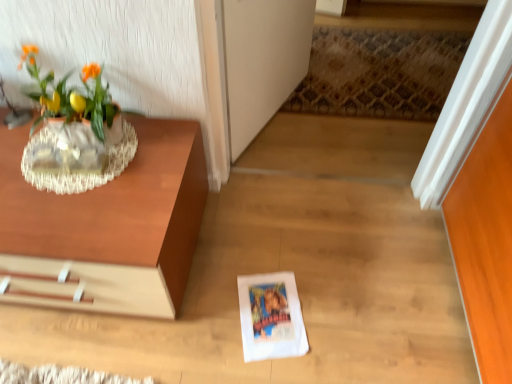
Question: From the image's perspective, would you say wooden table at left is shown under transparent glass door at center?

Choices:
 (A) no
 (B) yes

Answer: (B)

Question: From a real-world perspective, is wooden table at left physically below transparent glass door at center?

Choices:
 (A) yes
 (B) no

Answer: (A)

Question: Is wooden table at left beside transparent glass door at center?

Choices:
 (A) yes
 (B) no

Answer: (B)

Question: Is wooden table at left at the right side of transparent glass door at center?

Choices:
 (A) yes
 (B) no

Answer: (B)

Question: Is the depth of wooden table at left less than that of transparent glass door at center?

Choices:
 (A) yes
 (B) no

Answer: (A)

Question: From the image's perspective, is wooden table at left on transparent glass door at center?

Choices:
 (A) yes
 (B) no

Answer: (B)

Question: Is wooden table at left not within white paper at center?

Choices:
 (A) yes
 (B) no

Answer: (A)

Question: Is wooden table at left closer to camera compared to white paper at center?

Choices:
 (A) no
 (B) yes

Answer: (B)

Question: Is wooden table at left looking in the opposite direction of white paper at center?

Choices:
 (A) no
 (B) yes

Answer: (A)

Question: Can you confirm if wooden table at left is positioned to the right of white paper at center?

Choices:
 (A) no
 (B) yes

Answer: (A)

Question: Can you confirm if wooden table at left is thinner than white paper at center?

Choices:
 (A) no
 (B) yes

Answer: (A)

Question: Does wooden table at left have a greater width compared to white paper at center?

Choices:
 (A) yes
 (B) no

Answer: (A)

Question: From a real-world perspective, is white paper at center physically below wooden table at left?

Choices:
 (A) no
 (B) yes

Answer: (B)